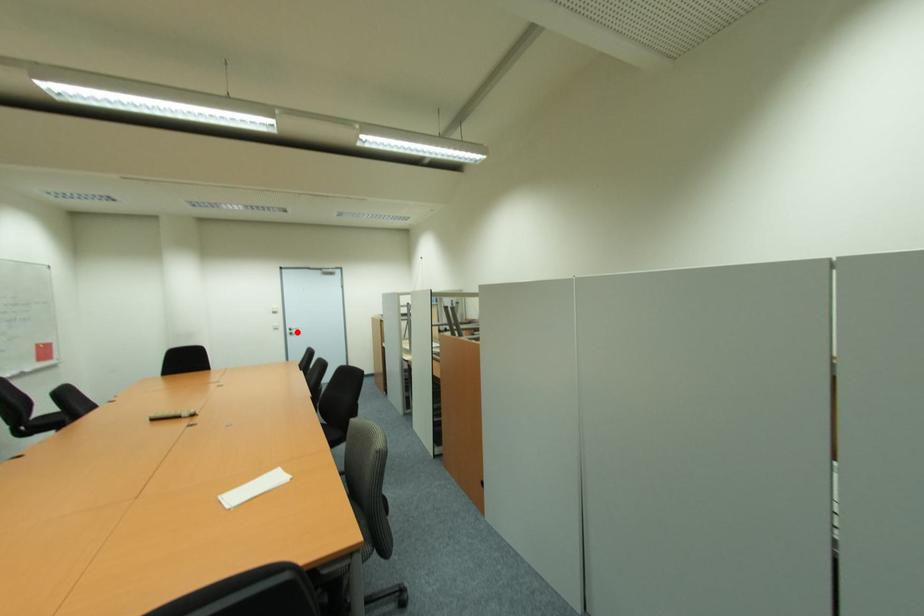
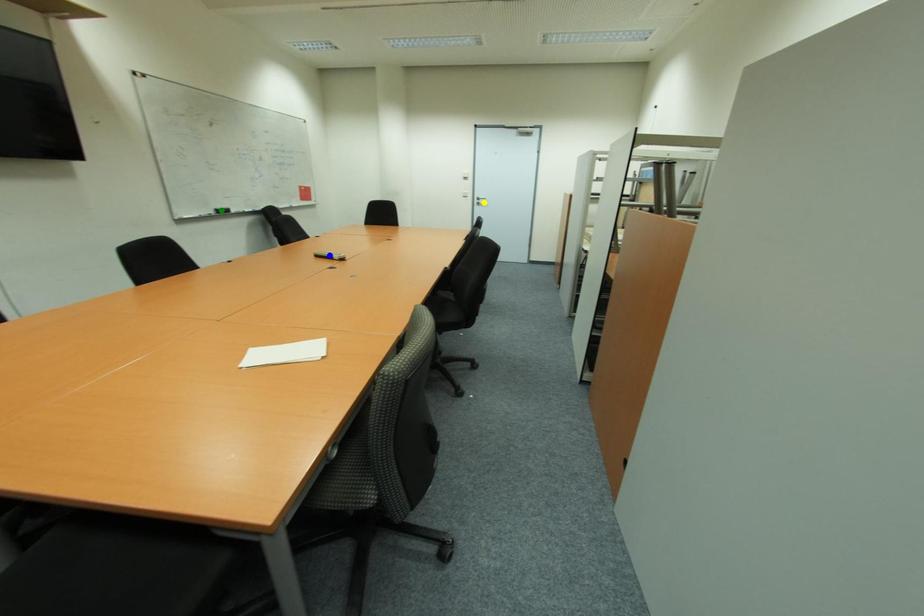
Question: I am providing you with two images of the same scene from different viewpoints. A red point is marked on the first image. You are given multiple points on the second image. Which spot in image 2 lines up with the point in image 1?

Choices:
 (A) yellow point
 (B) blue point
 (C) green point

Answer: (A)